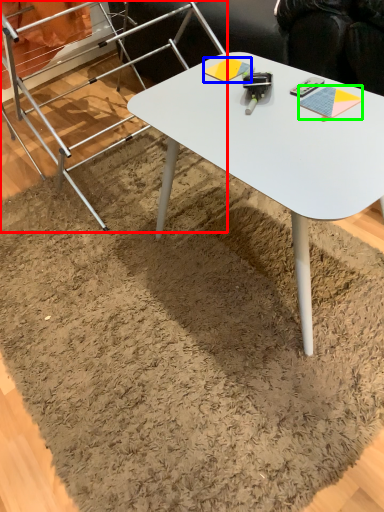
Question: Which object is positioned farthest from ladder (highlighted by a red box)? Select from notepad (highlighted by a blue box) and notepad (highlighted by a green box).

Choices:
 (A) notepad
 (B) notepad

Answer: (B)